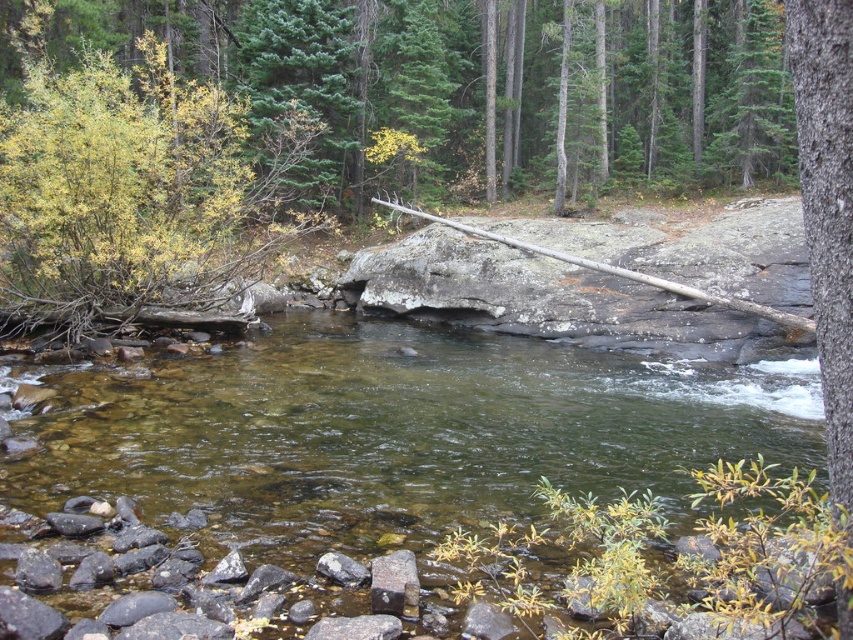
You are standing in the forest and want to walk from the point closer to you to the point further away. Which path would you take between point (x=567, y=401) and point (x=83, y=205)?

You should walk towards point (x=83, y=205) because point (x=567, y=401) is closer to you, so the further point is (x=83, y=205).